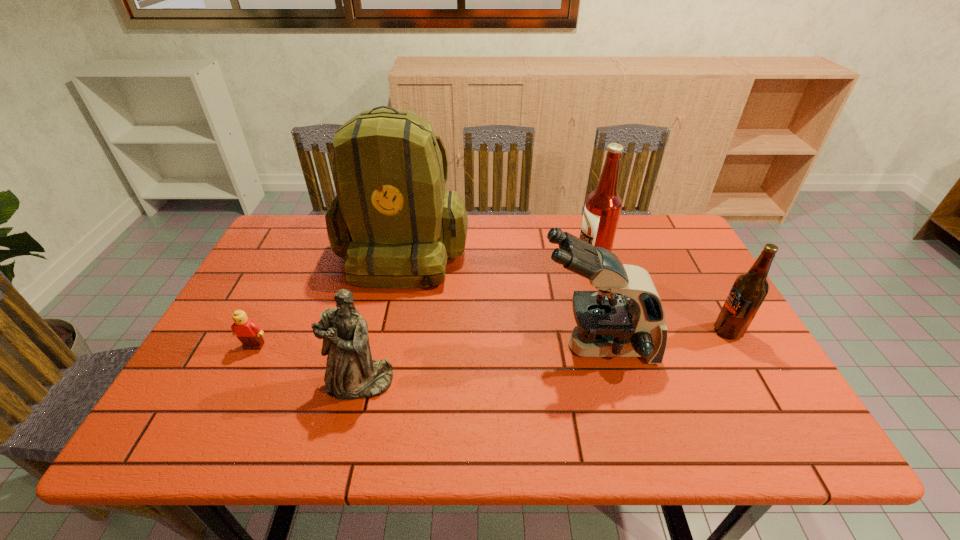
You are a GUI agent. You are given a task and a screenshot of the screen. Output one action in this format:
    pyautogui.click(x=<x>, y=<y>)
    Task: Click on the free spot that satisfies the following two spatial constraints: 1. on the label side of the alcohol; 2. on the face of the leftmost object
    The height and width of the screenshot is (540, 960).
    Given the screenshot: What is the action you would take?
    pyautogui.click(x=617, y=346)

Where is `free location that satisfies the following two spatial constraints: 1. on the label side of the alcohol; 2. on the face of the Lego`? The height and width of the screenshot is (540, 960). free location that satisfies the following two spatial constraints: 1. on the label side of the alcohol; 2. on the face of the Lego is located at coordinates (617, 346).

Identify the location of blank area in the image that satisfies the following two spatial constraints: 1. on the label side of the alcohol; 2. on the face of the leftmost object. (617, 346).

You are a GUI agent. You are given a task and a screenshot of the screen. Output one action in this format:
    pyautogui.click(x=<x>, y=<y>)
    Task: Click on the free region that satisfies the following two spatial constraints: 1. on the label side of the alcohol; 2. on the front-facing side of the figurine
    The width and height of the screenshot is (960, 540).
    Given the screenshot: What is the action you would take?
    pyautogui.click(x=629, y=383)